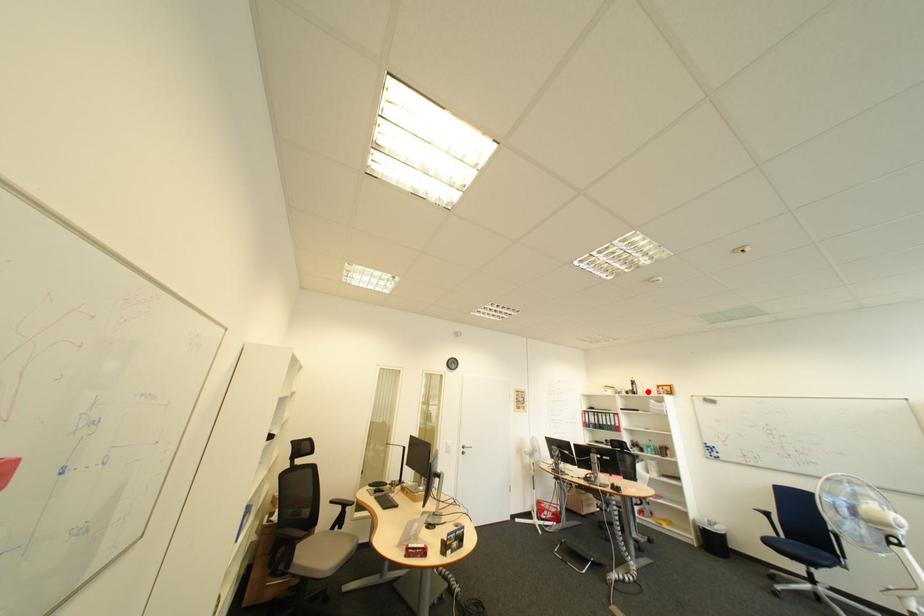
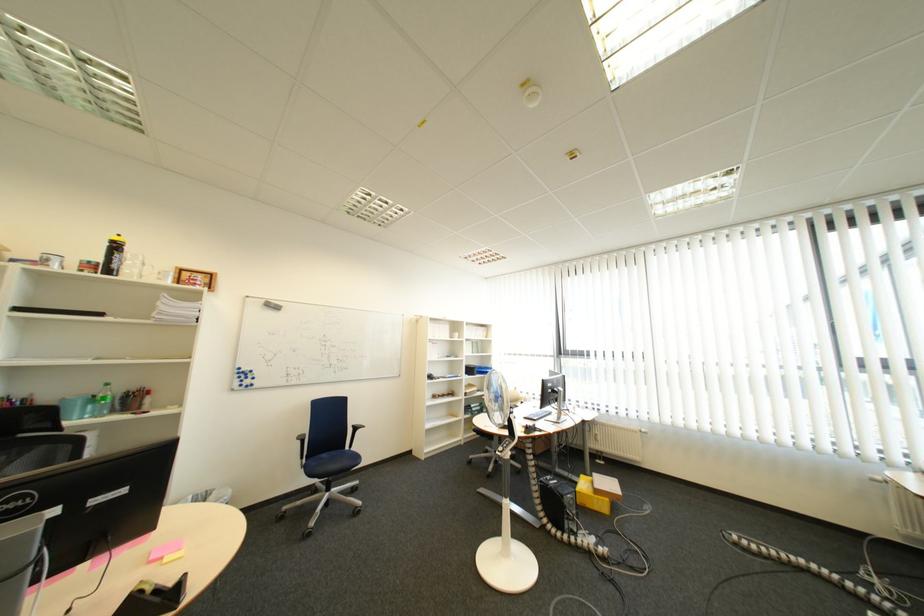
Find the pixel in the second image that matches the highlighted location in the first image.

(128, 267)